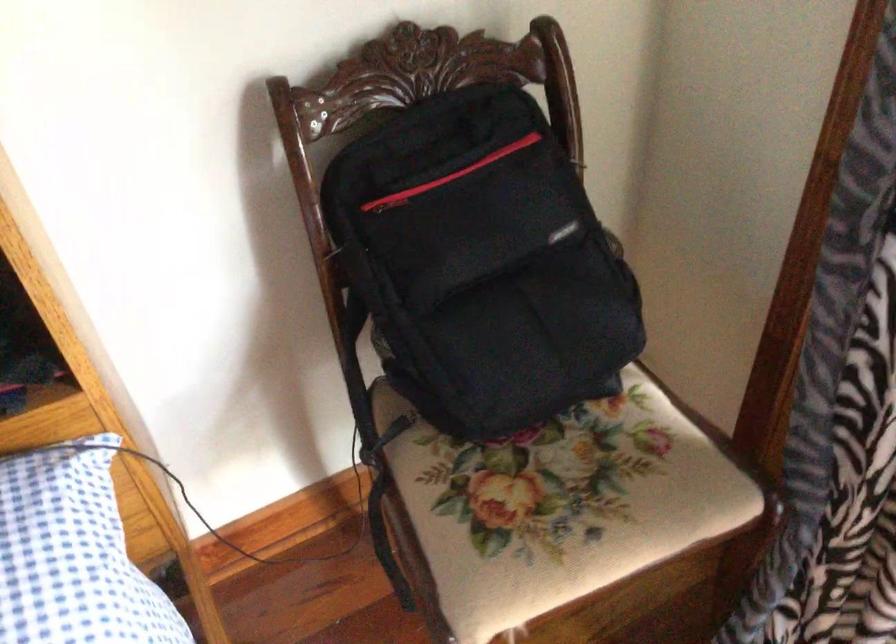
Where is `black backpack handle`? Image resolution: width=896 pixels, height=644 pixels. black backpack handle is located at coordinates (349, 343).